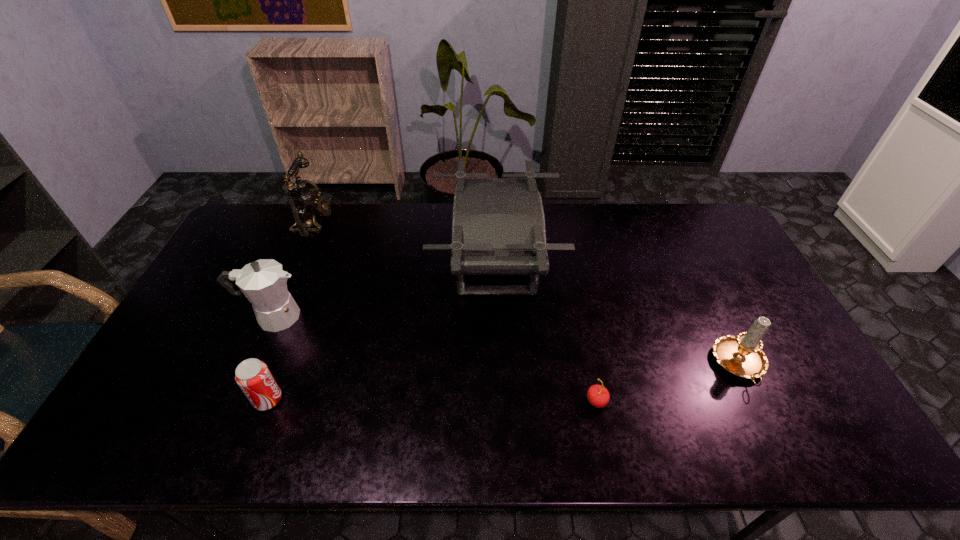
I want to click on telephone, so click(304, 200).

Locate an element on the screen. The width and height of the screenshot is (960, 540). drone is located at coordinates (498, 224).

I want to click on coffeepot, so click(x=263, y=282).

The image size is (960, 540). Find the location of `the fourth tallest object`. the fourth tallest object is located at coordinates (742, 355).

Locate an element on the screen. The image size is (960, 540). candle is located at coordinates point(742,355).

Where is `soda can`? soda can is located at coordinates (253, 377).

Locate an element on the screen. The width and height of the screenshot is (960, 540). the fifth object from left to right is located at coordinates (598, 396).

This screenshot has height=540, width=960. Find the location of `cherry`. cherry is located at coordinates (598, 396).

Where is `vacant space positioned 0.150m on the rotary dial of the telephone`? Image resolution: width=960 pixels, height=540 pixels. vacant space positioned 0.150m on the rotary dial of the telephone is located at coordinates (373, 222).

I want to click on vacant point located 0.330m with a camera mounted on the underside of the drone, so click(x=333, y=263).